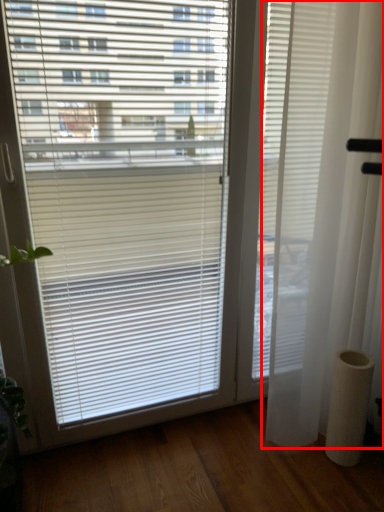
Question: From the image's perspective, what is the correct spatial relationship of curtain (annotated by the red box) in relation to pillar?

Choices:
 (A) below
 (B) above

Answer: (B)